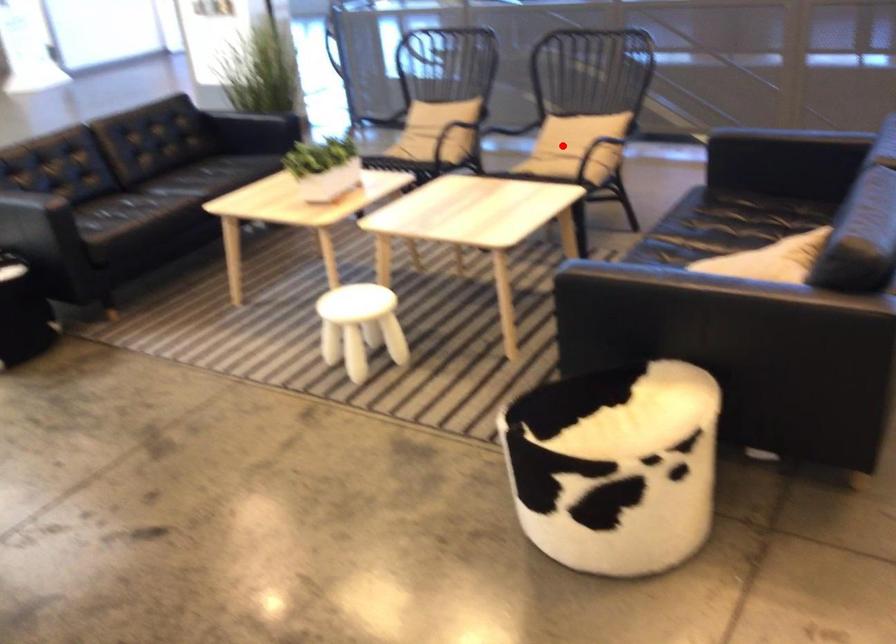
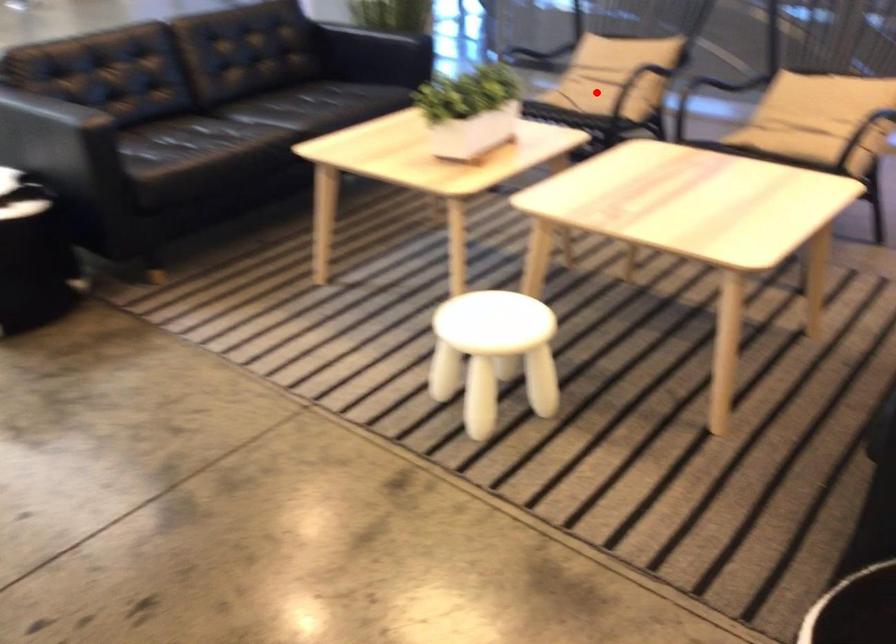
I am providing you with two images of the same scene from different viewpoints. A red point is marked on the first image and another point is marked on the second image. Is the red point in image1 aligned with the point shown in image2?

No